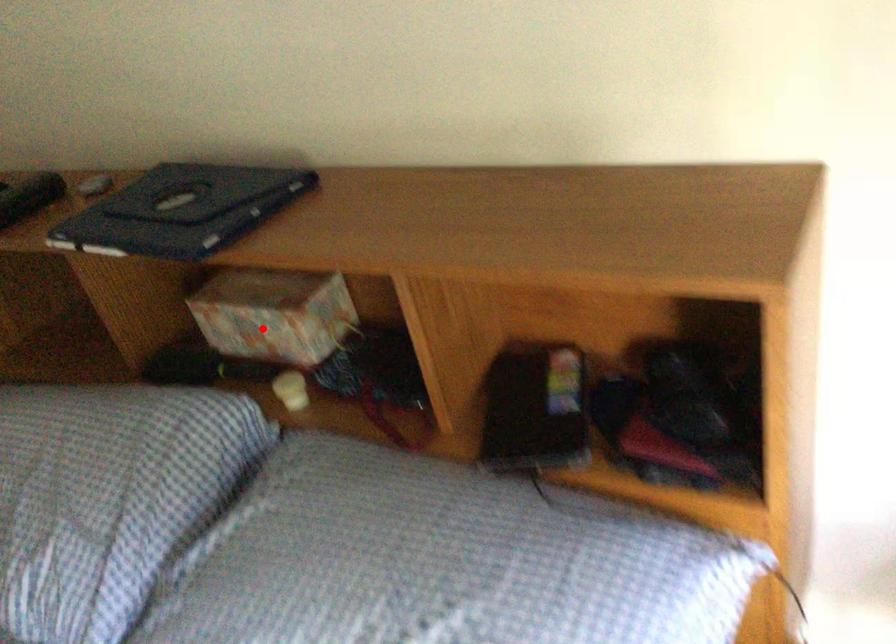
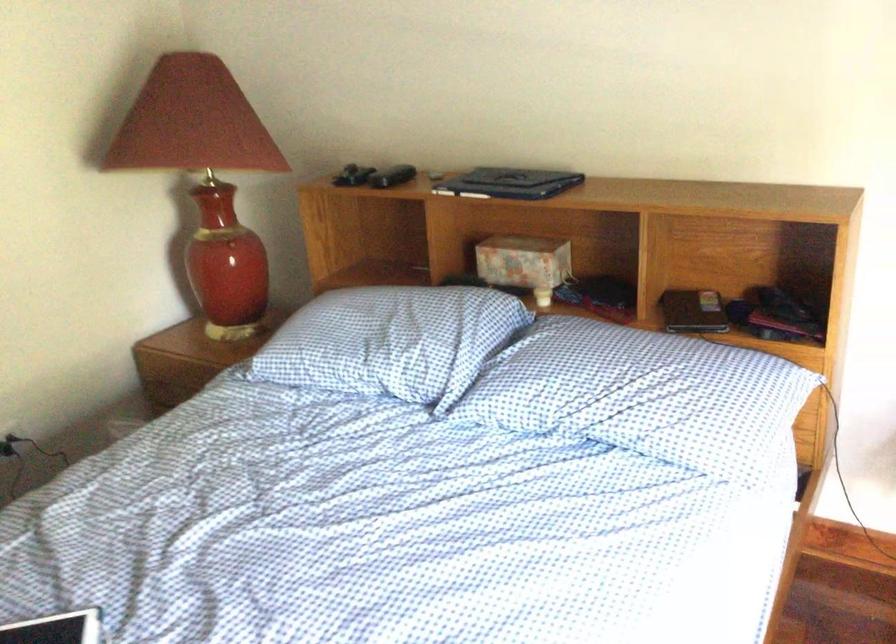
Where in the second image is the point corresponding to the highlighted location from the first image?

(524, 263)